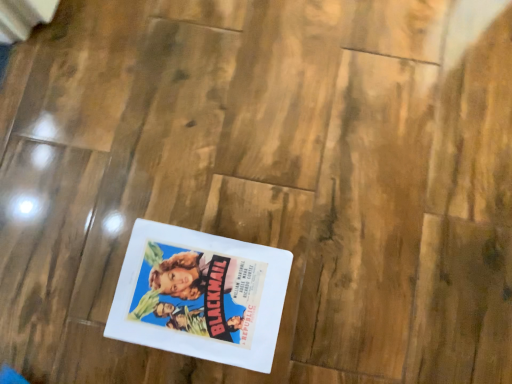
What are the coordinates of `free location above white paper at center (from a real-world perspective)` in the screenshot? It's located at (198, 293).